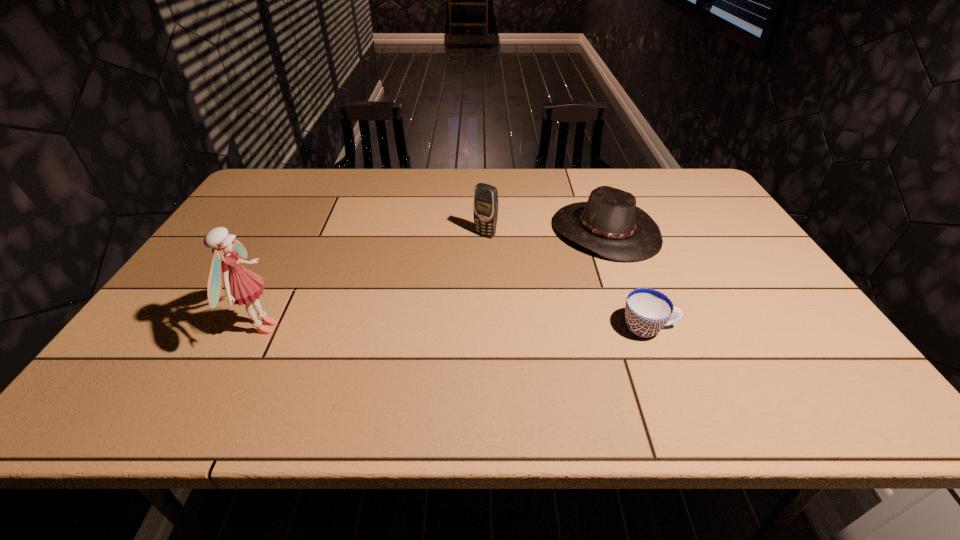
Identify the location of vacant space at the near left corner of the desktop. click(176, 340).

This screenshot has height=540, width=960. Find the location of `vacant space at the far right corner`. vacant space at the far right corner is located at coordinates tap(677, 187).

In the image, there is a desktop. Identify the location of free space at the near right corner. (827, 366).

Locate an element on the screen. This screenshot has height=540, width=960. unoccupied position between the leftmost object and the hat is located at coordinates (434, 279).

Where is `unoccupied area between the shortest object and the doll`? The height and width of the screenshot is (540, 960). unoccupied area between the shortest object and the doll is located at coordinates (455, 328).

Where is `vacant area between the second tallest object and the shortest object`? The width and height of the screenshot is (960, 540). vacant area between the second tallest object and the shortest object is located at coordinates (567, 281).

Where is `empty space between the shortest object and the second tallest object`? The width and height of the screenshot is (960, 540). empty space between the shortest object and the second tallest object is located at coordinates (567, 281).

I want to click on empty location between the cellular telephone and the doll, so click(373, 281).

Find the location of `free area in between the tallest object and the shortest object`. free area in between the tallest object and the shortest object is located at coordinates (455, 328).

This screenshot has height=540, width=960. I want to click on vacant space that's between the doll and the third tallest object, so click(434, 279).